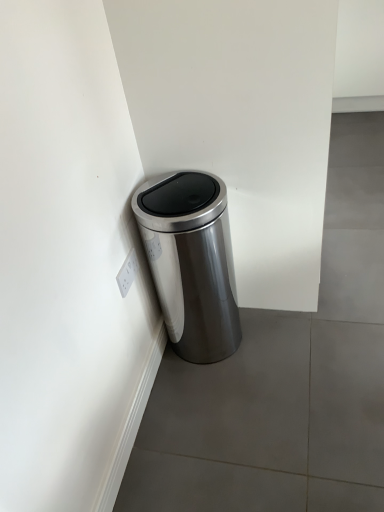
The image size is (384, 512). Describe the element at coordinates (127, 273) in the screenshot. I see `white plastic electric outlet at lower left` at that location.

Locate an element on the screen. Image resolution: width=384 pixels, height=512 pixels. white plastic electric outlet at lower left is located at coordinates (127, 273).

This screenshot has height=512, width=384. In order to click on satin silver trash can at corner in this screenshot , I will do `click(191, 262)`.

What do you see at coordinates (191, 262) in the screenshot? The height and width of the screenshot is (512, 384). I see `satin silver trash can at corner` at bounding box center [191, 262].

Where is `white plastic electric outlet at lower left`? white plastic electric outlet at lower left is located at coordinates (127, 273).

Which object is positioned more to the right, white plastic electric outlet at lower left or satin silver trash can at corner?

satin silver trash can at corner.

Does white plastic electric outlet at lower left lie behind satin silver trash can at corner?

Yes, it is.

Is point (121, 268) positioned after point (164, 314)?

No, (121, 268) is closer to viewer.

From the image's perspective, which is above, white plastic electric outlet at lower left or satin silver trash can at corner?

satin silver trash can at corner, from the image's perspective.

From a real-world perspective, between white plastic electric outlet at lower left and satin silver trash can at corner, who is vertically lower?

satin silver trash can at corner.

Which object is thinner, white plastic electric outlet at lower left or satin silver trash can at corner?

white plastic electric outlet at lower left is thinner.

Is white plastic electric outlet at lower left taller than satin silver trash can at corner?

In fact, white plastic electric outlet at lower left may be shorter than satin silver trash can at corner.

Which of these two, white plastic electric outlet at lower left or satin silver trash can at corner, is bigger?

With larger size is satin silver trash can at corner.

Can we say white plastic electric outlet at lower left lies outside satin silver trash can at corner?

Yes, white plastic electric outlet at lower left is located beyond the bounds of satin silver trash can at corner.

Does white plastic electric outlet at lower left touch satin silver trash can at corner?

Result: There is a gap between white plastic electric outlet at lower left and satin silver trash can at corner.

Is white plastic electric outlet at lower left facing towards satin silver trash can at corner?

No, white plastic electric outlet at lower left is not oriented towards satin silver trash can at corner.

Based on the photo, how different are the orientations of white plastic electric outlet at lower left and satin silver trash can at corner in degrees?

There is a 0.014-degree angle between the facing directions of white plastic electric outlet at lower left and satin silver trash can at corner.

Where is `waste container lying above the white plastic electric outlet at lower left (from the image's perspective)`? waste container lying above the white plastic electric outlet at lower left (from the image's perspective) is located at coordinates (191, 262).

In the scene shown: Which object is positioned more to the left, satin silver trash can at corner or white plastic electric outlet at lower left?

white plastic electric outlet at lower left.

Does satin silver trash can at corner lie behind white plastic electric outlet at lower left?

No, satin silver trash can at corner is in front of white plastic electric outlet at lower left.

Does point (229, 346) come farther from viewer compared to point (131, 267)?

Yes, point (229, 346) is farther from viewer.

From the image's perspective, is satin silver trash can at corner positioned above or below white plastic electric outlet at lower left?

Answer: satin silver trash can at corner is above white plastic electric outlet at lower left.

From a real-world perspective, is satin silver trash can at corner located higher than white plastic electric outlet at lower left?

No, from a real-world perspective, satin silver trash can at corner is not over white plastic electric outlet at lower left

Between satin silver trash can at corner and white plastic electric outlet at lower left, which one has smaller width?

Thinner between the two is white plastic electric outlet at lower left.

Between satin silver trash can at corner and white plastic electric outlet at lower left, which one has more height?

Standing taller between the two is satin silver trash can at corner.

Is satin silver trash can at corner smaller than white plastic electric outlet at lower left?

Actually, satin silver trash can at corner might be larger than white plastic electric outlet at lower left.

In the scene shown: Is satin silver trash can at corner located outside white plastic electric outlet at lower left?

Absolutely, satin silver trash can at corner is external to white plastic electric outlet at lower left.

Are satin silver trash can at corner and white plastic electric outlet at lower left beside each other?

satin silver trash can at corner and white plastic electric outlet at lower left are not in contact.

Does satin silver trash can at corner turn towards white plastic electric outlet at lower left?

No, satin silver trash can at corner is not turned towards white plastic electric outlet at lower left.

What's the angular difference between satin silver trash can at corner and white plastic electric outlet at lower left's facing directions?

The angular difference between satin silver trash can at corner and white plastic electric outlet at lower left is 0.014 degrees.

Identify the location of waste container above the white plastic electric outlet at lower left (from the image's perspective). Image resolution: width=384 pixels, height=512 pixels. (191, 262).

You are a GUI agent. You are given a task and a screenshot of the screen. Output one action in this format:
    pyautogui.click(x=<x>, y=<y>)
    Task: Click on the waste container that appears on the right of white plastic electric outlet at lower left
    
    Given the screenshot: What is the action you would take?
    pyautogui.click(x=191, y=262)

Find the location of `electric outlet behind the satin silver trash can at corner`. electric outlet behind the satin silver trash can at corner is located at coordinates (127, 273).